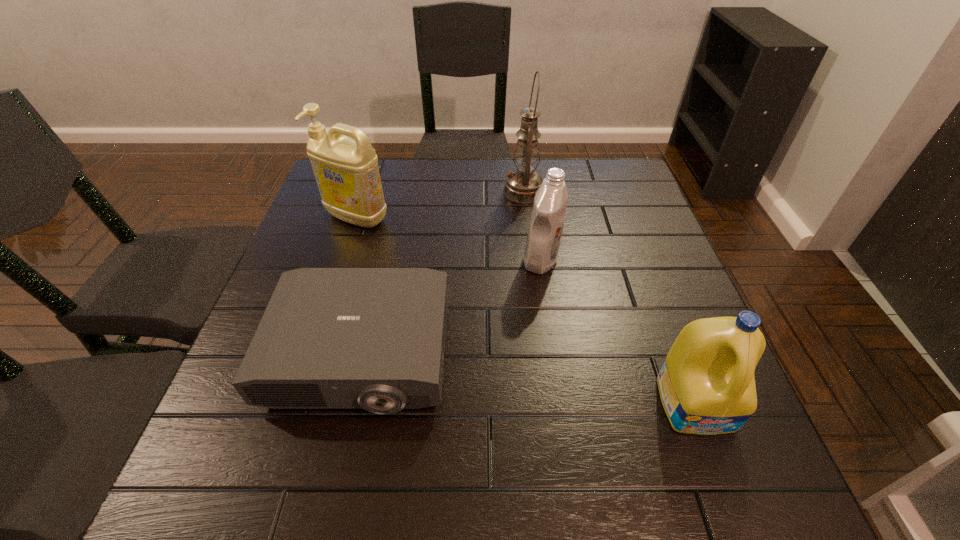
Locate an element on the screen. This screenshot has width=960, height=540. free space located on the left of the second detergent from right to left is located at coordinates (414, 260).

The height and width of the screenshot is (540, 960). Identify the location of free space located 0.110m on the label of the rightmost detergent. (735, 507).

Identify the location of vacant space located 0.130m on the front-facing side of the projector. The width and height of the screenshot is (960, 540). (327, 497).

You are a GUI agent. You are given a task and a screenshot of the screen. Output one action in this format:
    pyautogui.click(x=<x>, y=<y>)
    Task: Click on the oil lamp that is at the far edge
    This screenshot has height=540, width=960.
    Given the screenshot: What is the action you would take?
    pyautogui.click(x=521, y=185)

Find the location of a particular element. detergent that is at the far edge is located at coordinates (346, 171).

Image resolution: width=960 pixels, height=540 pixels. Find the location of `detergent at the left edge`. detergent at the left edge is located at coordinates (346, 171).

Where is `projector that is positioned at the left edge`? projector that is positioned at the left edge is located at coordinates (330, 338).

This screenshot has width=960, height=540. I want to click on object at the right edge, so click(x=706, y=384).

Identify the location of object that is at the far left corner. This screenshot has height=540, width=960. (346, 171).

In the image, there is a desktop. In order to click on vacant region at the far edge in this screenshot , I will do `click(540, 164)`.